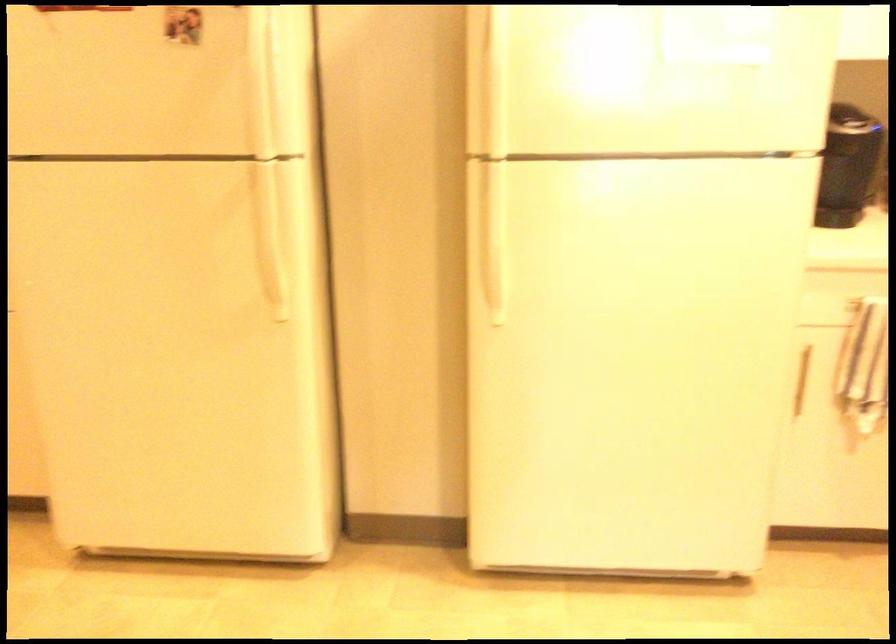
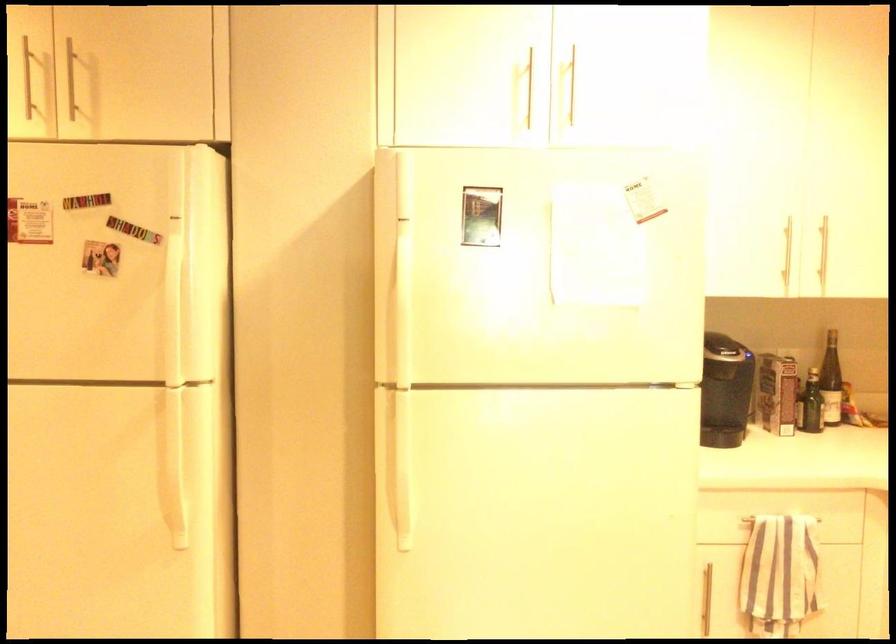
Question: The first image is from the beginning of the video and the second image is from the end. How did the camera likely rotate when shooting the video?

Choices:
 (A) Left
 (B) Right
 (C) Up
 (D) Down

Answer: (C)